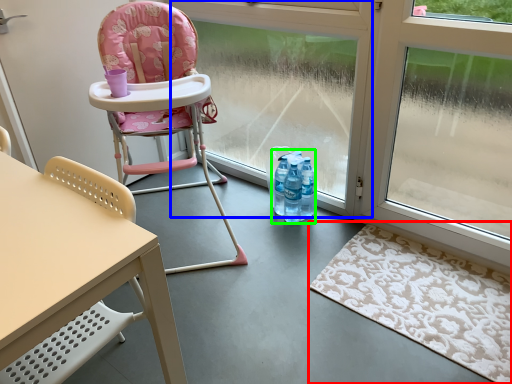
Question: Based on their relative distances, which object is nearer to mat (highlighted by a red box)? Choose from window frame (highlighted by a blue box) and bottle (highlighted by a green box).

Choices:
 (A) window frame
 (B) bottle

Answer: (B)